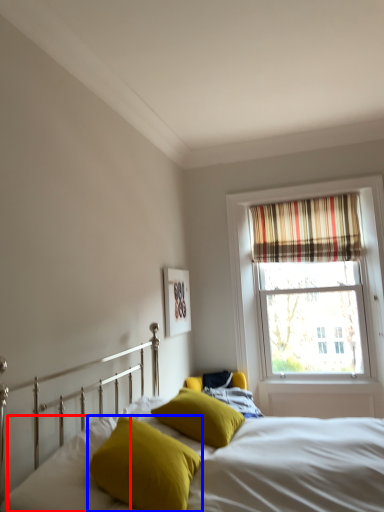
Question: Which object is further to the camera taking this photo, pillow (highlighted by a red box) or pillow (highlighted by a blue box)?

Choices:
 (A) pillow
 (B) pillow

Answer: (B)